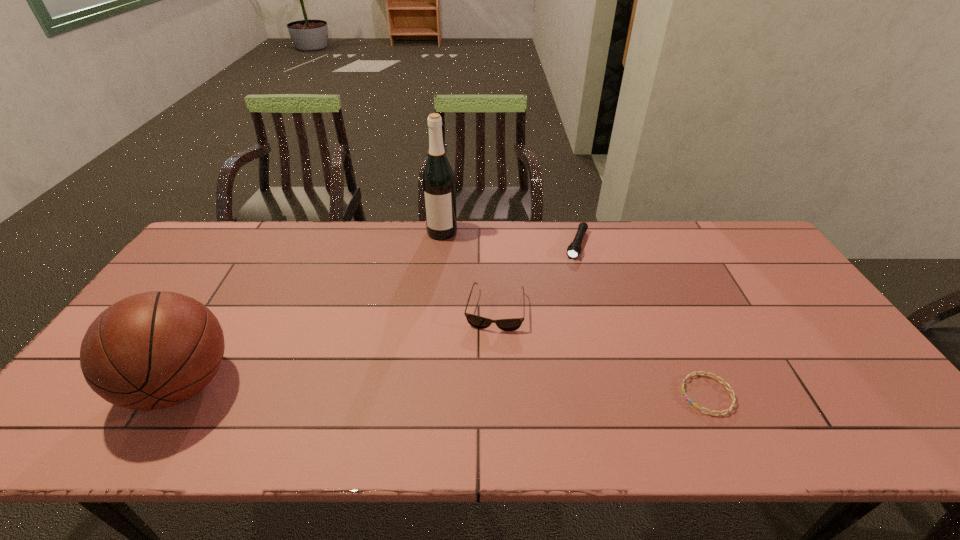
Find the location of a particular element. The height and width of the screenshot is (540, 960). vacant region located 0.300m on the surface of the bracelet showing star-shaped elements is located at coordinates (555, 395).

Image resolution: width=960 pixels, height=540 pixels. What are the coordinates of `free location located on the surface of the bracelet showing star-shaped elements` in the screenshot? It's located at coord(632,395).

The height and width of the screenshot is (540, 960). In order to click on free space located on the surface of the bracelet showing star-shaped elements in this screenshot , I will do coord(614,395).

Where is `free location located on the label of the fourth object from right to left`? The width and height of the screenshot is (960, 540). free location located on the label of the fourth object from right to left is located at coordinates (423, 305).

This screenshot has height=540, width=960. What are the coordinates of `free spot located on the label of the fourth object from right to left` in the screenshot? It's located at (435, 259).

In order to click on vacant position located 0.100m on the label of the fourth object from right to left in this screenshot , I will do `click(435, 259)`.

Identify the location of free space located at the lens end of the fourth object from left to right. The height and width of the screenshot is (540, 960). (552, 321).

The width and height of the screenshot is (960, 540). I want to click on vacant space located at the lens end of the fourth object from left to right, so click(549, 328).

You are a GUI agent. You are given a task and a screenshot of the screen. Output one action in this format:
    pyautogui.click(x=<x>, y=<y>)
    Task: Click on the free region located 0.090m at the lens end of the fourth object from left to right
    
    Given the screenshot: What is the action you would take?
    pyautogui.click(x=569, y=277)

Locate an element on the screen. vacant region located on the lenses of the third object from left to right is located at coordinates (481, 405).